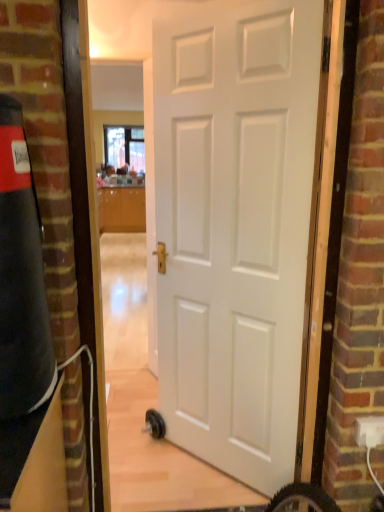
Question: Is white matte door at center in contact with clear glass window at upper center?

Choices:
 (A) no
 (B) yes

Answer: (A)

Question: Considering the relative positions of white matte door at center and clear glass window at upper center in the image provided, is white matte door at center to the left of clear glass window at upper center from the viewer's perspective?

Choices:
 (A) yes
 (B) no

Answer: (B)

Question: Can you confirm if white matte door at center is smaller than clear glass window at upper center?

Choices:
 (A) no
 (B) yes

Answer: (A)

Question: Is white matte door at center shorter than clear glass window at upper center?

Choices:
 (A) no
 (B) yes

Answer: (A)

Question: From a real-world perspective, is white matte door at center positioned over clear glass window at upper center based on gravity?

Choices:
 (A) yes
 (B) no

Answer: (B)

Question: In terms of size, does white plastic electric outlet at lower right appear bigger or smaller than glossy wood cabinetry at center?

Choices:
 (A) small
 (B) big

Answer: (A)

Question: Is white plastic electric outlet at lower right wider or thinner than glossy wood cabinetry at center?

Choices:
 (A) thin
 (B) wide

Answer: (A)

Question: Is point (362, 434) positioned closer to the camera than point (117, 202)?

Choices:
 (A) farther
 (B) closer

Answer: (B)

Question: Is white plastic electric outlet at lower right to the left or to the right of glossy wood cabinetry at center in the image?

Choices:
 (A) left
 (B) right

Answer: (B)

Question: Is point (380, 437) closer or farther from the camera than point (221, 266)?

Choices:
 (A) closer
 (B) farther

Answer: (A)

Question: Visually, is white plastic electric outlet at lower right positioned to the left or to the right of white matte door at center?

Choices:
 (A) left
 (B) right

Answer: (B)

Question: Based on their sizes in the image, would you say white plastic electric outlet at lower right is bigger or smaller than white matte door at center?

Choices:
 (A) big
 (B) small

Answer: (B)

Question: Is white plastic electric outlet at lower right inside the boundaries of white matte door at center, or outside?

Choices:
 (A) inside
 (B) outside

Answer: (B)

Question: From the image's perspective, is clear glass window at upper center located above or below white matte door at center?

Choices:
 (A) below
 (B) above

Answer: (B)

Question: Considering the positions of clear glass window at upper center and white matte door at center in the image, is clear glass window at upper center taller or shorter than white matte door at center?

Choices:
 (A) tall
 (B) short

Answer: (B)